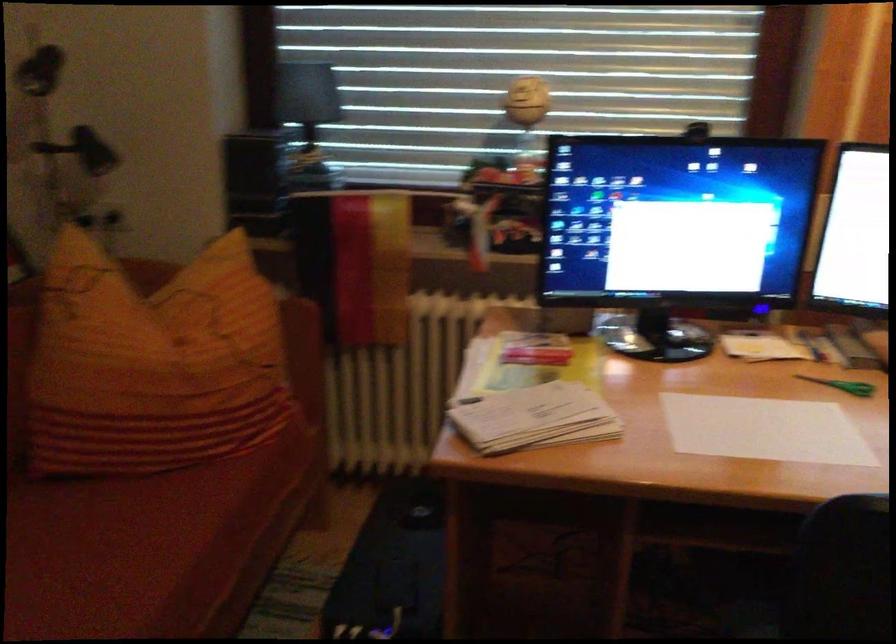
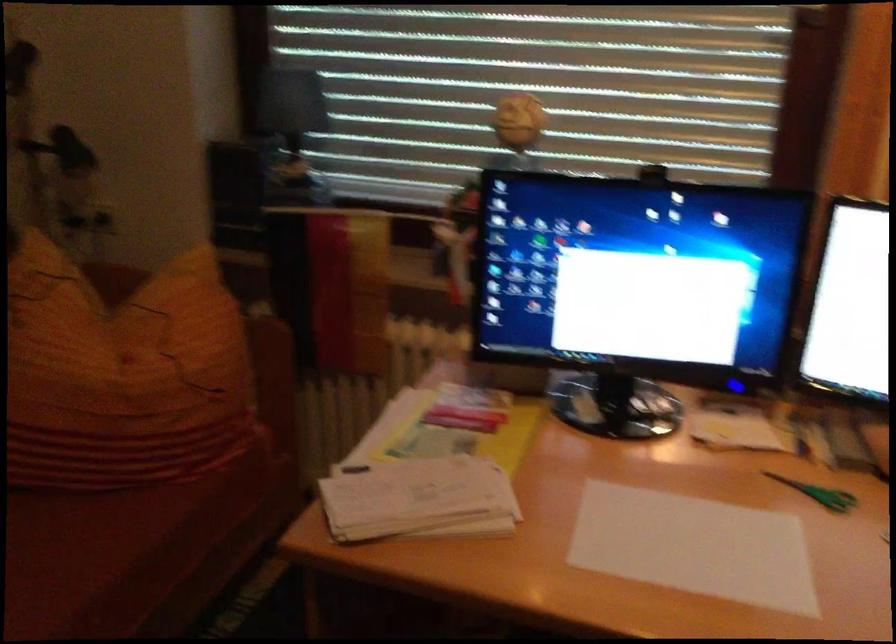
Where in the second image is the point corresponding to pixel 685 129 from the first image?

(650, 174)